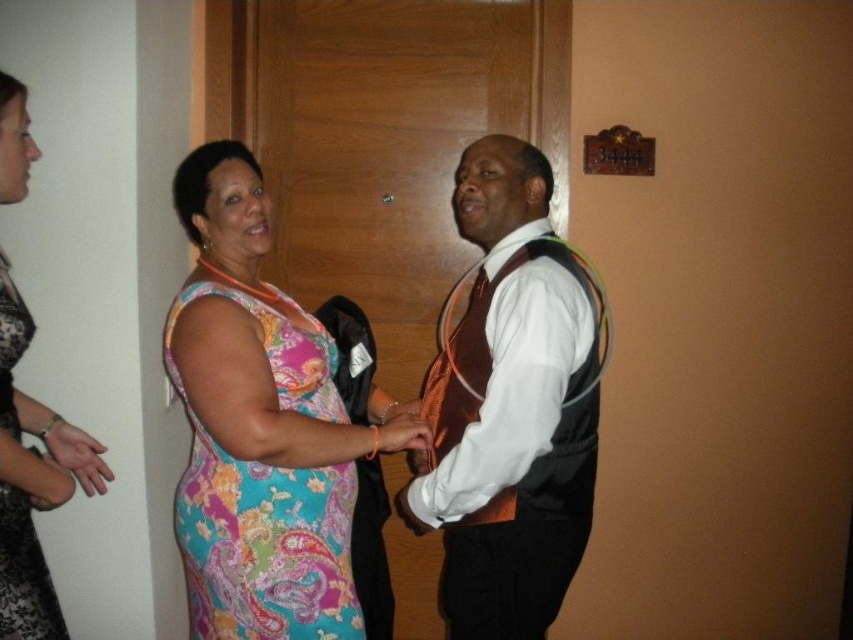
Question: Is floral fabric dress at center smaller than matte black hand at lower left?

Choices:
 (A) no
 (B) yes

Answer: (A)

Question: Is floral-patterned fabric dress at center bigger than matte black hand at lower left?

Choices:
 (A) no
 (B) yes

Answer: (B)

Question: Among these objects, which one is farthest from the camera?

Choices:
 (A) floral fabric dress at center
 (B) lace fabric dress at left
 (C) orange satin vest at center
 (D) floral-patterned fabric dress at center

Answer: (C)

Question: Among these objects, which one is farthest from the camera?

Choices:
 (A) orange satin vest at center
 (B) lace fabric dress at left

Answer: (A)

Question: Is orange satin vest at center to the right of floral fabric dress at center from the viewer's perspective?

Choices:
 (A) yes
 (B) no

Answer: (A)

Question: Among these objects, which one is farthest from the camera?

Choices:
 (A) matte black hand at lower left
 (B) floral-patterned fabric dress at center

Answer: (B)